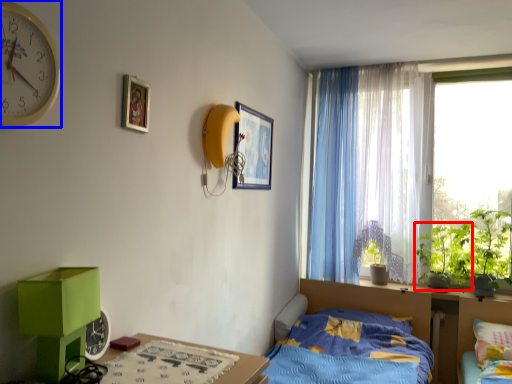
Question: Which object appears farthest to the camera in this image, plant (highlighted by a red box) or clock (highlighted by a blue box)?

Choices:
 (A) plant
 (B) clock

Answer: (A)